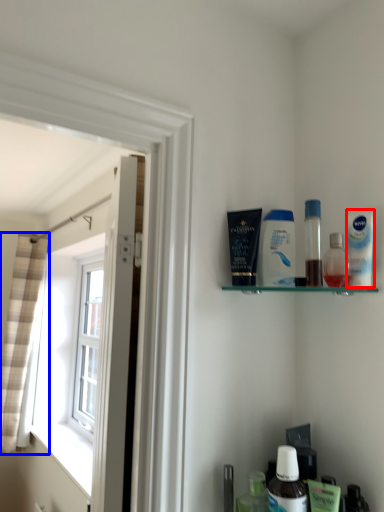
Question: Which point is further to the camera, mouthwash (highlighted by a red box) or curtain (highlighted by a blue box)?

Choices:
 (A) mouthwash
 (B) curtain

Answer: (B)